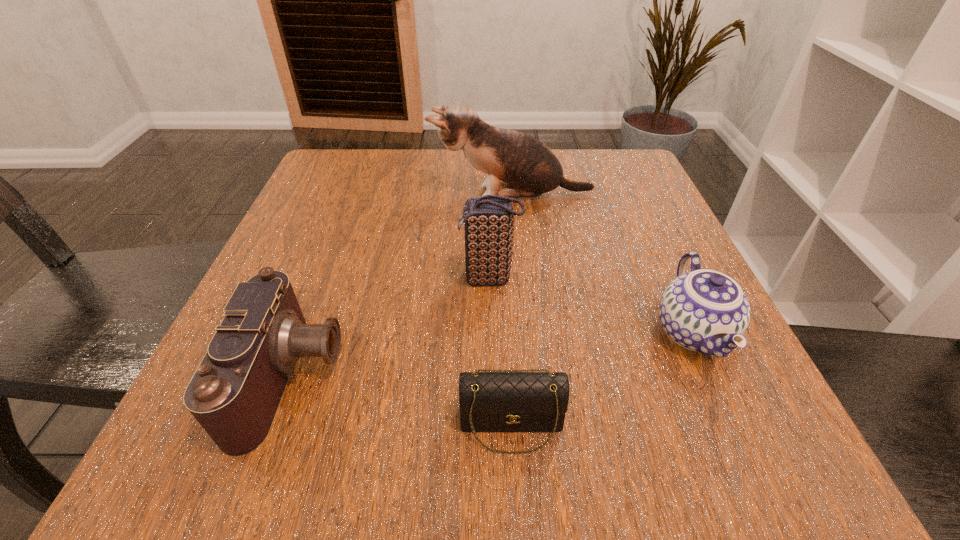
Identify the location of free spot between the farther clutch bag and the rightmost object. (591, 306).

Identify the location of vacant point located between the farther clutch bag and the camera. (391, 328).

Where is `free space between the shortest object and the chinaware`? The image size is (960, 540). free space between the shortest object and the chinaware is located at coordinates (602, 379).

This screenshot has height=540, width=960. In order to click on free area in between the camera and the second tallest object in this screenshot , I will do tap(391, 328).

This screenshot has width=960, height=540. Find the location of `empty space that is in between the second tallest object and the camera`. empty space that is in between the second tallest object and the camera is located at coordinates point(391,328).

Identify the location of free area in between the shorter clutch bag and the farther clutch bag. The image size is (960, 540). (500, 352).

Where is `vacant space that is in between the chinaware and the shortest object`? vacant space that is in between the chinaware and the shortest object is located at coordinates (602, 379).

The image size is (960, 540). Find the location of `unoccupied area between the camera and the farthest object`. unoccupied area between the camera and the farthest object is located at coordinates (402, 286).

The width and height of the screenshot is (960, 540). What are the coordinates of `object that is the closest one to the rightmost object` in the screenshot? It's located at (497, 400).

Where is `object that is the fourth closest to the shortest object`? object that is the fourth closest to the shortest object is located at coordinates (528, 168).